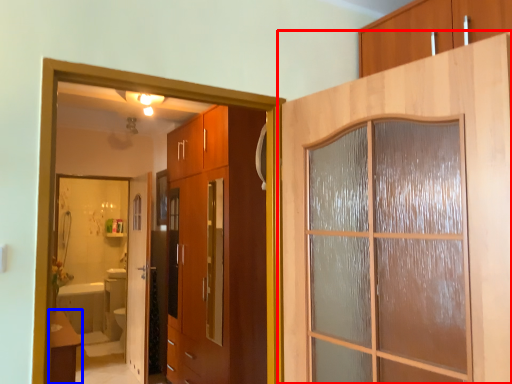
Question: Which of the following is the farthest to the observer, door (highlighted by a red box) or table (highlighted by a blue box)?

Choices:
 (A) door
 (B) table

Answer: (B)